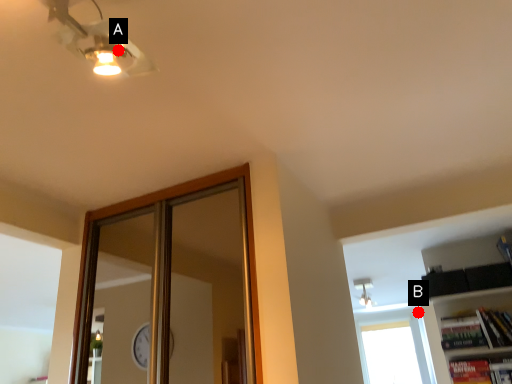
Question: Two points are circled on the image, labeled by A and B beside each circle. Which point is closer to the camera?

Choices:
 (A) A is closer
 (B) B is closer

Answer: (A)